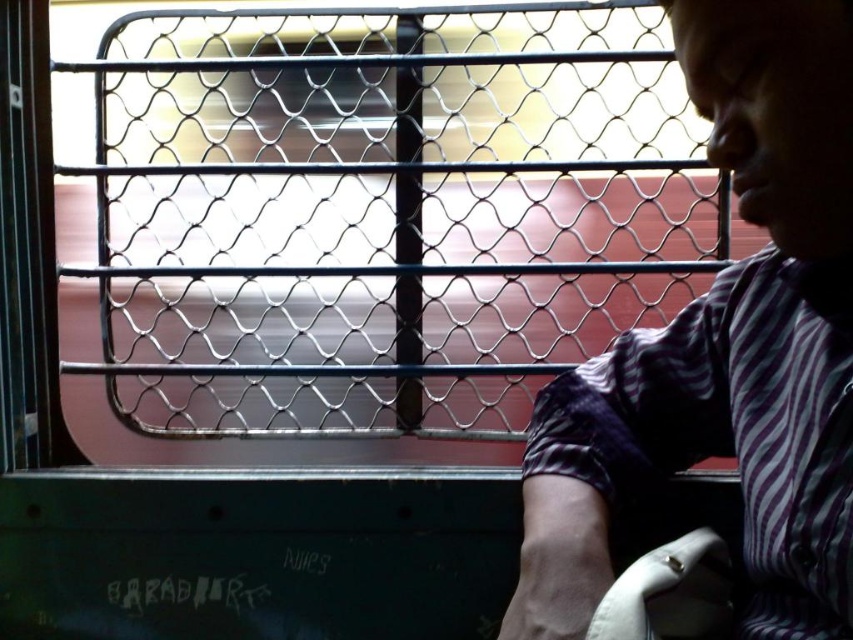
You are a passenger on a moving train and want to place your phone on the metallic mesh at center. The phone is 6 inches long. Can you place it without it falling off?

The metallic mesh at center has a diamond pattern with horizontal bars. The distance between the bars is 3.62 feet, which is much wider than the phone. Therefore, placing the phone on the metallic mesh at center would cause it to fall through the gaps between the bars.

You are a passenger on a moving train and want to check the view outside through the window. You notice the metallic mesh at center and the purple striped shirt at right. Which object is wider in the image?

The metallic mesh at center is wider than the purple striped shirt at right according to the description.